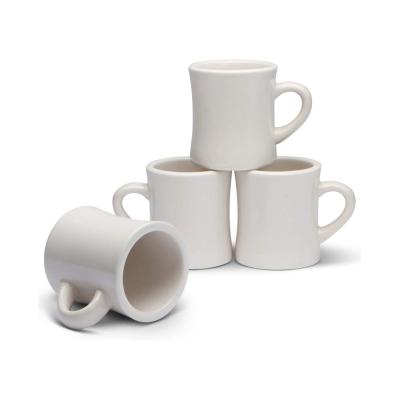
I want to click on mugs, so click(119, 262), click(187, 212), click(238, 135), click(266, 215).